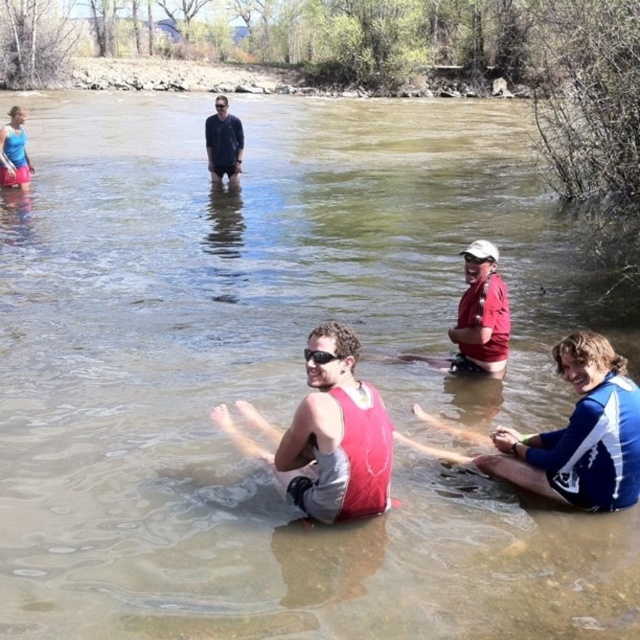
Between matte red tank top at center and matte blue tank top at upper left, which one appears on the left side from the viewer's perspective?

From the viewer's perspective, matte blue tank top at upper left appears more on the left side.

Is point (230, 436) positioned in front of point (4, 145)?

Yes, it is in front of point (4, 145).

Locate an element on the screen. Image resolution: width=640 pixels, height=640 pixels. matte red tank top at center is located at coordinates (332, 436).

Does matte red shirt at center have a greater width compared to black smooth shirt at upper center?

Incorrect, matte red shirt at center's width does not surpass black smooth shirt at upper center's.

Where is `matte red shirt at center`? The image size is (640, 640). matte red shirt at center is located at coordinates (477, 324).

You are a GUI agent. You are given a task and a screenshot of the screen. Output one action in this format:
    pyautogui.click(x=<x>, y=<y>)
    Task: Click on the matte red shirt at center
    The image size is (640, 640).
    Given the screenshot: What is the action you would take?
    pyautogui.click(x=477, y=324)

Who is shorter, matte red shirt at center or clear plastic goggles at center?

clear plastic goggles at center is shorter.

Consider the image. Does matte red shirt at center have a lesser width compared to clear plastic goggles at center?

In fact, matte red shirt at center might be wider than clear plastic goggles at center.

Where is `matte red shirt at center`? matte red shirt at center is located at coordinates (477, 324).